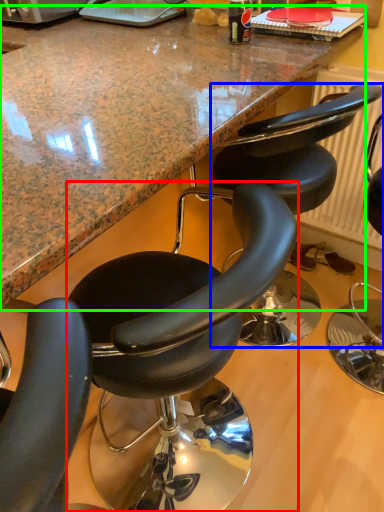
Question: Which is nearer to the chair (highlighted by a red box)? chair (highlighted by a blue box) or countertop (highlighted by a green box).

Choices:
 (A) chair
 (B) countertop

Answer: (A)